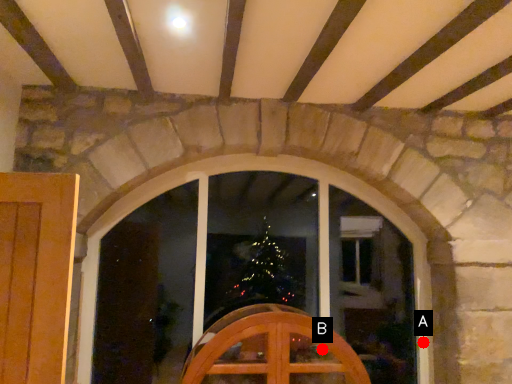
Question: Two points are circled on the image, labeled by A and B beside each circle. Which point appears closest to the camera in this image?

Choices:
 (A) A is closer
 (B) B is closer

Answer: (B)